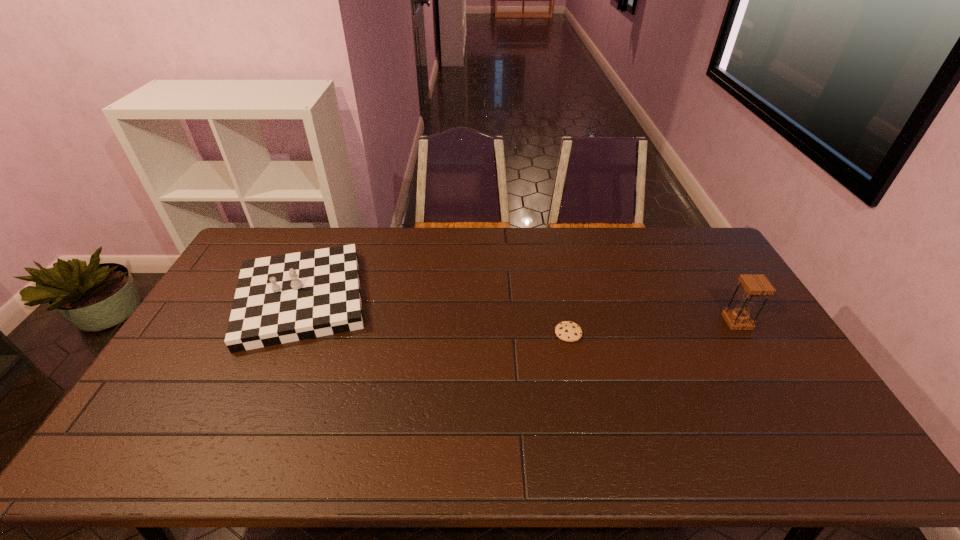
Identify the location of object located in the left edge section of the desktop. Image resolution: width=960 pixels, height=540 pixels. (279, 299).

Locate an element on the screen. object that is positioned at the right edge is located at coordinates (755, 285).

The height and width of the screenshot is (540, 960). Find the location of `object positioned at the far left corner`. object positioned at the far left corner is located at coordinates (279, 299).

In the image, there is a desktop. At what (x,y) coordinates should I click in order to perform the action: click on free space at the far edge. Please return your answer as a coordinate pair (x, y). This screenshot has width=960, height=540. Looking at the image, I should click on (519, 255).

The image size is (960, 540). In order to click on vacant region at the near edge of the desktop in this screenshot , I will do point(263,438).

The height and width of the screenshot is (540, 960). I want to click on vacant space at the left edge, so click(x=198, y=357).

Image resolution: width=960 pixels, height=540 pixels. In the image, there is a desktop. Find the location of `vacant space at the right edge`. vacant space at the right edge is located at coordinates coord(731,291).

Find the location of a particular element. The width and height of the screenshot is (960, 540). vacant space at the far right corner is located at coordinates (721, 264).

This screenshot has height=540, width=960. I want to click on free point between the tallest object and the second object from left to right, so click(x=653, y=327).

Locate an element on the screen. The height and width of the screenshot is (540, 960). free spot between the second object from right to left and the leftmost object is located at coordinates (435, 316).